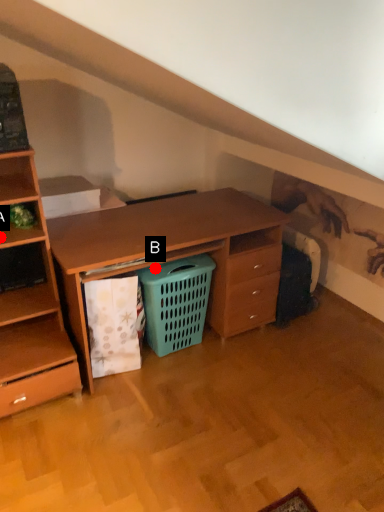
Question: Two points are circled on the image, labeled by A and B beside each circle. Which point is closer to the camera?

Choices:
 (A) A is closer
 (B) B is closer

Answer: (A)